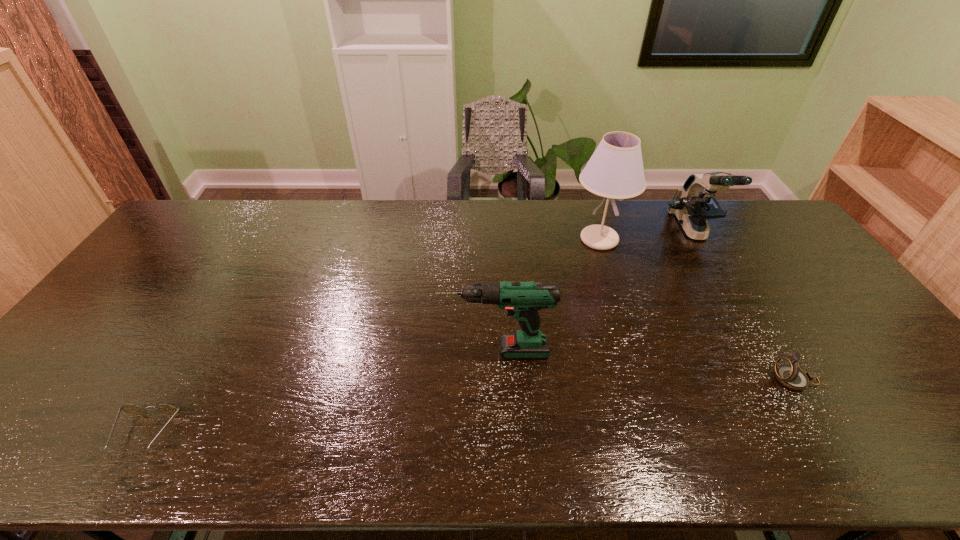
Locate an element on the screen. vacant space situated 0.160m through the eyepieces of the microscope is located at coordinates (727, 288).

Find the location of a particular element. This screenshot has width=960, height=540. vacant space located 0.110m on the handle side of the drill is located at coordinates (399, 352).

Where is `vacant space located 0.380m on the handle side of the drill`? This screenshot has height=540, width=960. vacant space located 0.380m on the handle side of the drill is located at coordinates (297, 352).

At what (x,y) coordinates should I click in order to perform the action: click on vacant area situated on the handle side of the drill. Please return your answer as a coordinate pair (x, y). The height and width of the screenshot is (540, 960). Looking at the image, I should click on (396, 352).

The width and height of the screenshot is (960, 540). I want to click on blank space located on the face of the second shortest object, so click(724, 380).

This screenshot has width=960, height=540. Identify the location of vacant point located on the face of the second shortest object. (668, 380).

This screenshot has width=960, height=540. I want to click on free space located on the face of the second shortest object, so click(x=704, y=380).

Locate an element on the screen. lampshade present at the far edge is located at coordinates (615, 170).

Where is `microscope situated at the far edge`? This screenshot has width=960, height=540. microscope situated at the far edge is located at coordinates (694, 203).

Identify the location of object situated at the near edge. (132, 409).